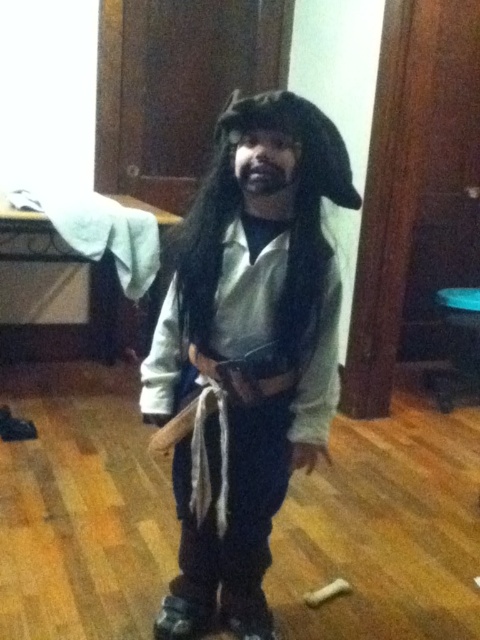
You are a costume designer examining the image. You need to adjust the position of the white matte pirate costume at center and the black matte beard at center so that the beard is now to the right of the costume. Is the current arrangement correct according to the image?

The white matte pirate costume at center is currently to the left of the black matte beard at center, so the beard is already positioned to the right of the costume. Therefore, the current arrangement is correct.

You are a costume designer assessing the fit of the pirate costume. The white matte pirate costume at center and the black matte beard at center are part of the ensemble. Which item is wider?

The white matte pirate costume at center is wider than the black matte beard at center.